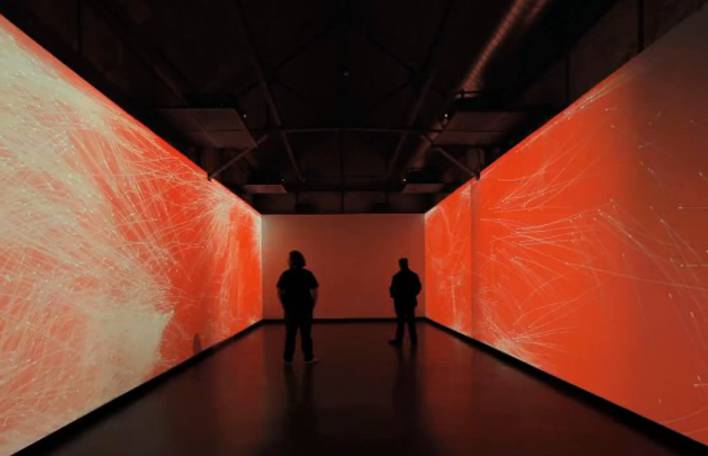
What are the coordinates of `floor` in the screenshot? It's located at (x=326, y=388).